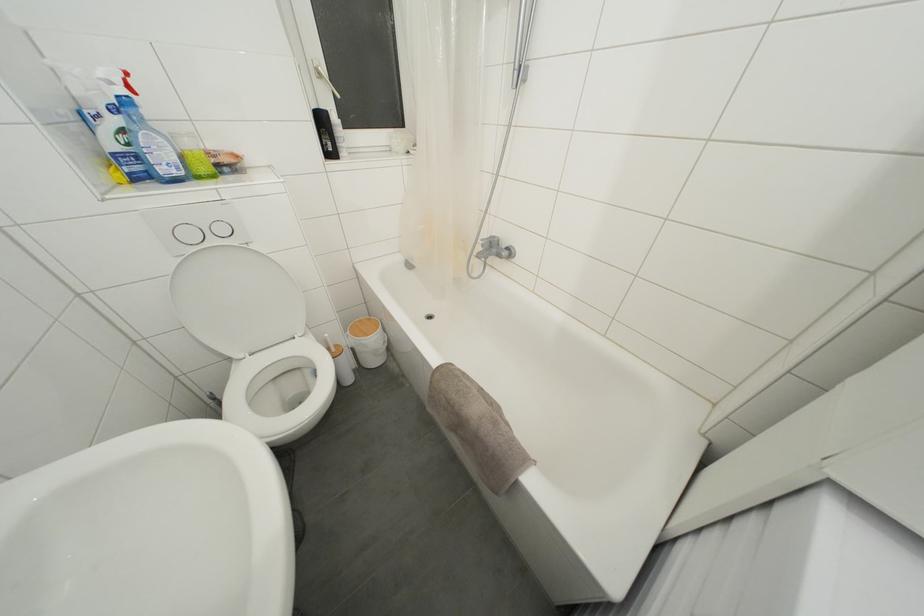
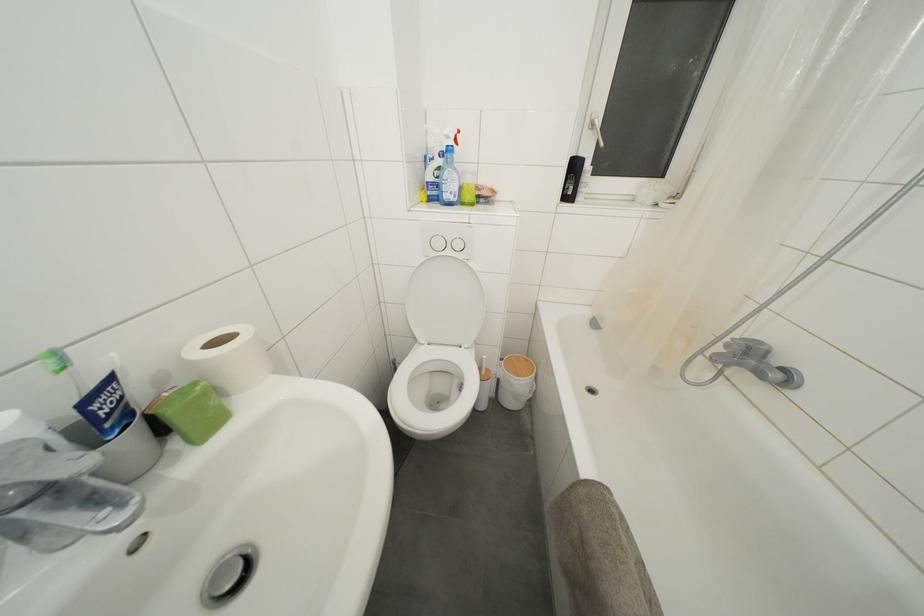
Find the pixel in the second image that matches (x=226, y=235) in the first image.

(463, 251)